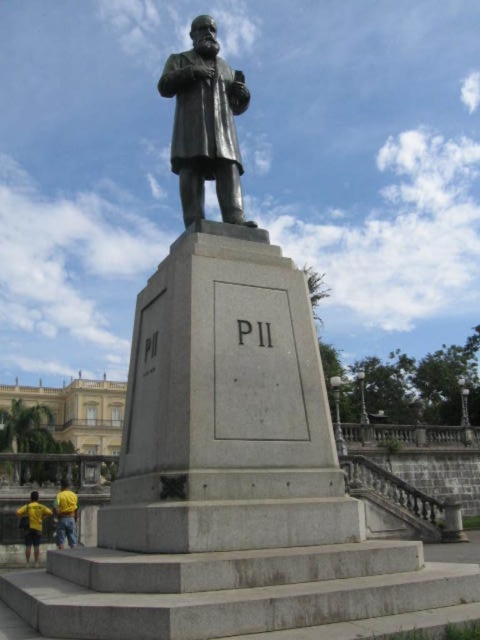
Find the location of `bronze statue at center`. bronze statue at center is located at coordinates (204, 124).

Who is shorter, bronze statue at center or yellow shirt at lower left?

With less height is yellow shirt at lower left.

Where is `bronze statue at center`? The image size is (480, 640). bronze statue at center is located at coordinates (204, 124).

Where is `bronze statue at center`? This screenshot has height=640, width=480. bronze statue at center is located at coordinates (204, 124).

Can you confirm if bronze statue at center is bigger than yellow fabric at lower left?

Yes.

Does bronze statue at center have a smaller size compared to yellow fabric at lower left?

Actually, bronze statue at center might be larger than yellow fabric at lower left.

Find the location of a particular element. Image resolution: width=480 pixels, height=640 pixels. bronze statue at center is located at coordinates (204, 124).

Is point (35, 506) less distant than point (70, 540)?

No, it is behind (70, 540).

This screenshot has width=480, height=640. In order to click on yellow shirt at lower left in this screenshot , I will do `click(33, 524)`.